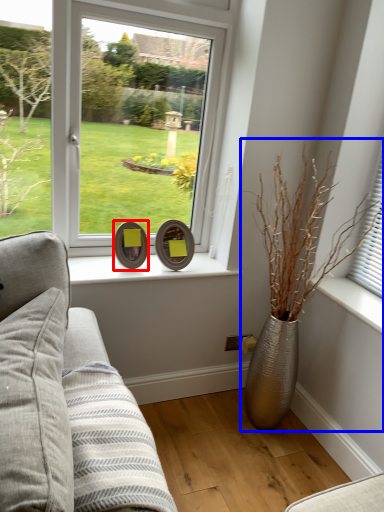
Question: Which of the following is the farthest to the observer, picture frame (highlighted by a red box) or houseplant (highlighted by a blue box)?

Choices:
 (A) picture frame
 (B) houseplant

Answer: (A)